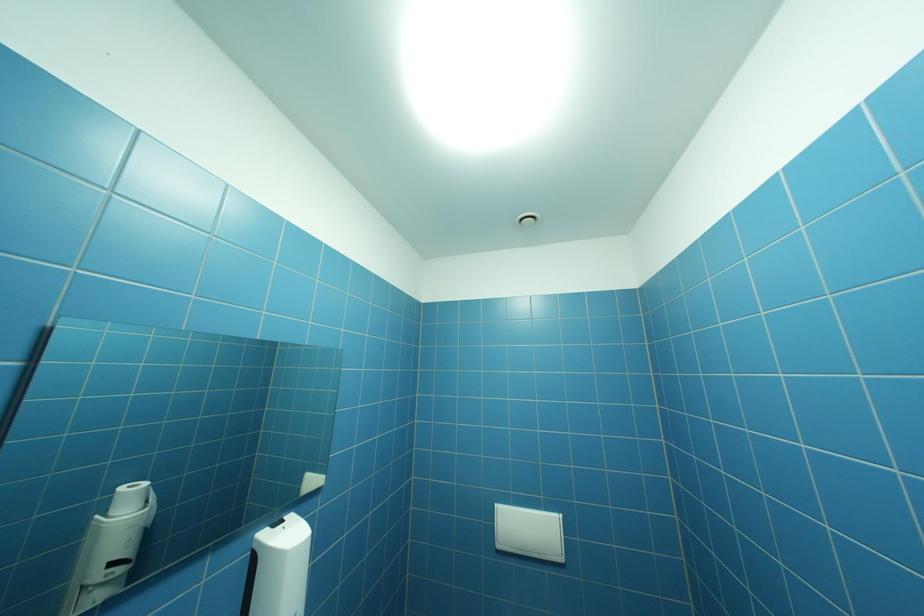
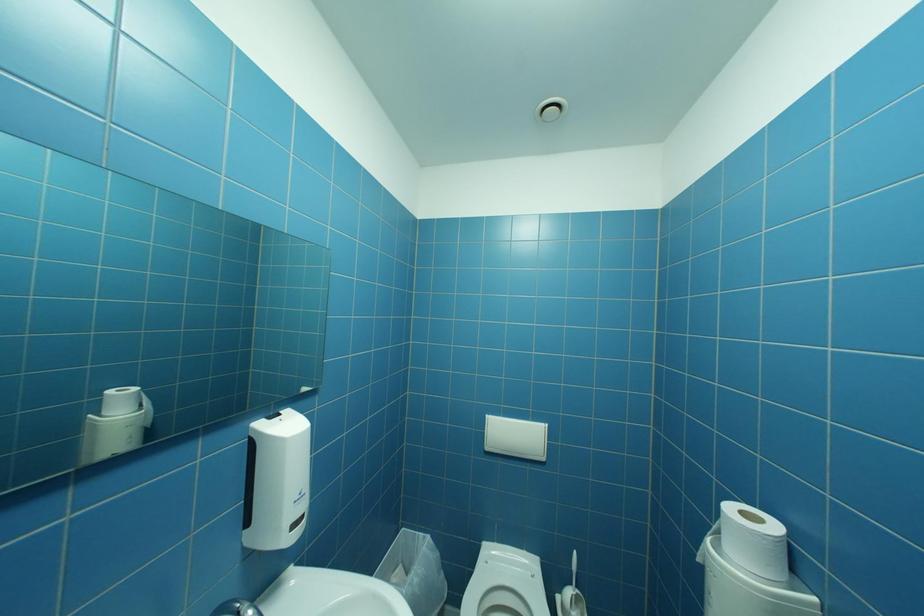
In the scene shown: Which direction would the cameraman need to move to produce the second image?

The cameraman walked toward left, forward.